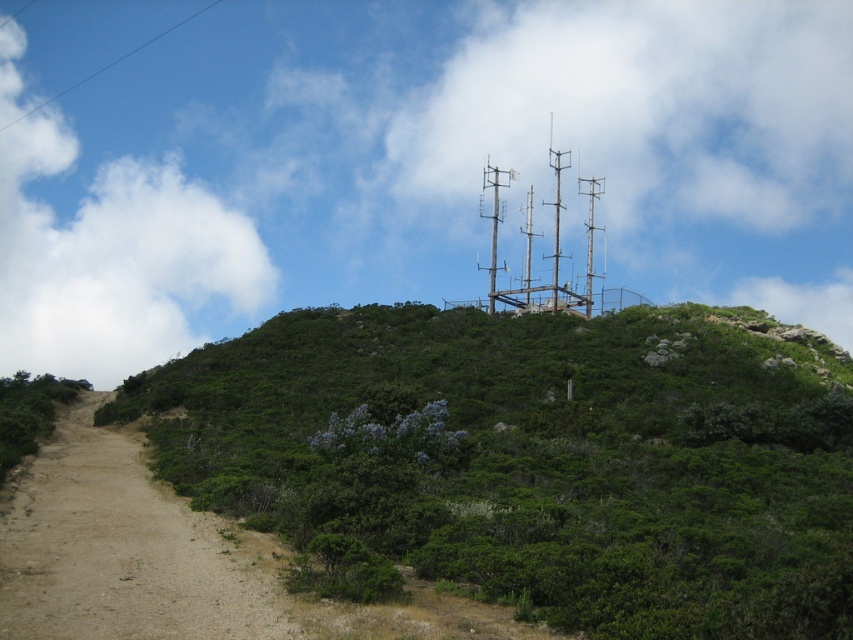
You are a hiker planning to hike up the hill and want to know which area takes up more space in the image between the brown dirt path at lower left and the metallic gray antenna at upper center. Which one is it?

The metallic gray antenna at upper center occupies more space in the image than the brown dirt path at lower left.

You are standing at the base of the hill and want to reach the communication towers at the top. There are two points marked on the path leading up the hill. Which point, point 1 at coordinates (448, 550) or point 2 at coordinates (489, 312), is closer to you as you start your climb?

Point 1 at coordinates (448, 550) is closer to you as you start your climb because it is closer to the camera compared to point 2 at coordinates (489, 312).

You are a hiker planning to climb the hill. You notice the green leafy shrubs at upper center and the metallic gray antennas at upper center. Which object is taller, and how might this affect your climbing route?

The metallic gray antennas at upper center are taller than the green leafy shrubs at upper center. Since the antennas are taller, they might obstruct your view or require you to navigate around them, potentially altering your climbing route.